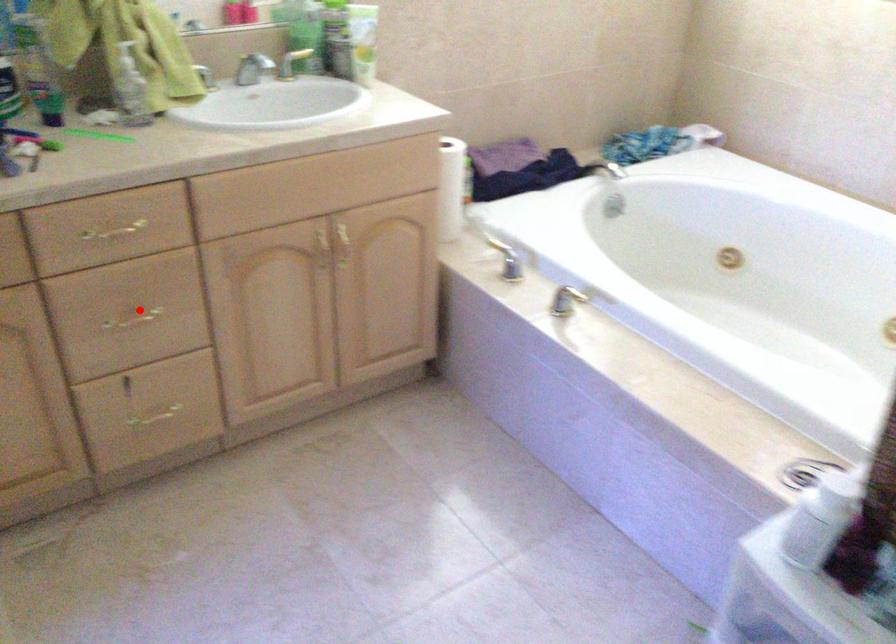
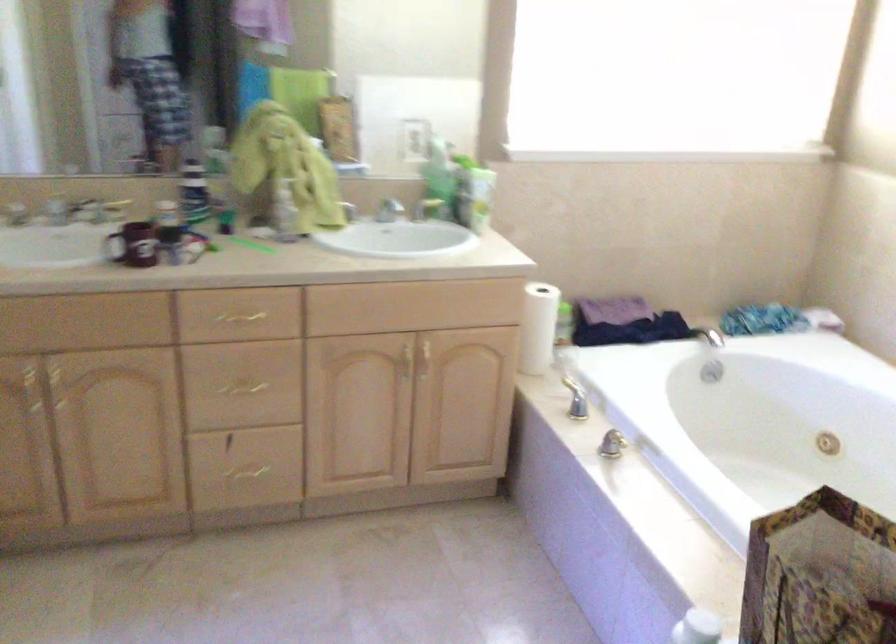
Question: A red point is marked in image1. In image2, is the corresponding 3D point closer to the camera or farther? Reply with the corresponding letter.

Choices:
 (A) The corresponding 3D point is closer.
 (B) The corresponding 3D point is farther.

Answer: (B)